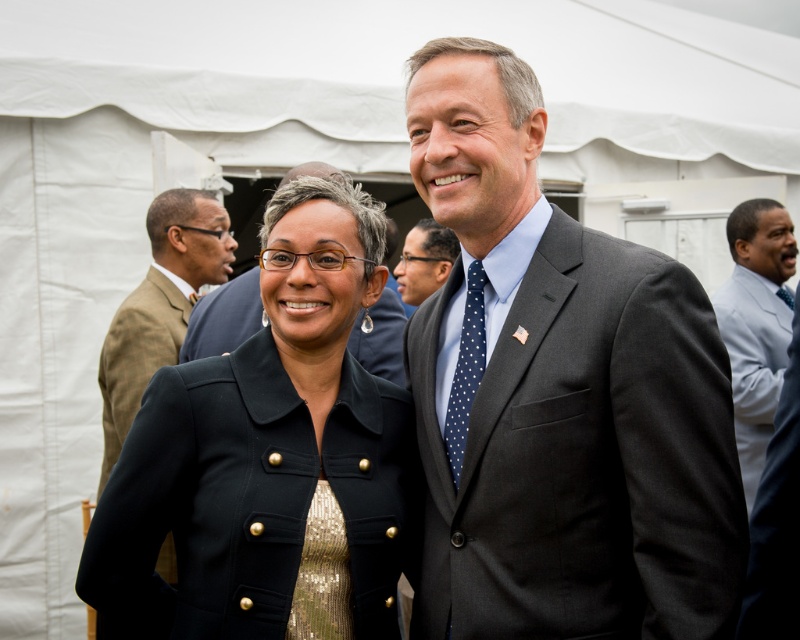
Can you confirm if black sequined dress at center is positioned to the right of polka dot tie at center?

No, black sequined dress at center is not to the right of polka dot tie at center.

The height and width of the screenshot is (640, 800). What do you see at coordinates (270, 458) in the screenshot?
I see `black sequined dress at center` at bounding box center [270, 458].

Locate an element on the screen. The height and width of the screenshot is (640, 800). black sequined dress at center is located at coordinates pyautogui.click(x=270, y=458).

The image size is (800, 640). I want to click on black sequined dress at center, so click(x=270, y=458).

Which is behind, point (188, 326) or point (302, 577)?

The point (188, 326) is behind.

Who is positioned more to the right, black matte jacket at center or gold sequined dress at center?

Positioned to the right is gold sequined dress at center.

What do you see at coordinates (224, 317) in the screenshot?
I see `black matte jacket at center` at bounding box center [224, 317].

The image size is (800, 640). What are the coordinates of `black matte jacket at center` in the screenshot? It's located at (224, 317).

Which is behind, point (454, 579) or point (748, 481)?

Point (748, 481)

Does dark gray suit at center have a lesser width compared to light blue shirt at right?

Answer: No.

Where is `dark gray suit at center`? The image size is (800, 640). dark gray suit at center is located at coordinates 558,394.